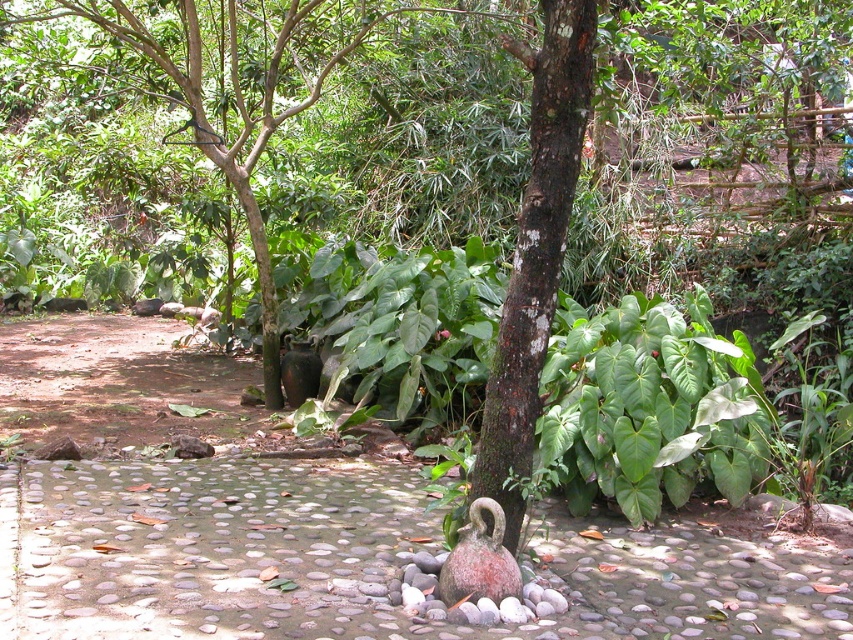
You are a gardener who wants to place a new decorative item on the pebble stone path at center. The item is 30 cm in length. Can the rusty ceramic swan at center currently on the path accommodate this new item without overlapping?

The pebble stone path at center is bigger than the rusty ceramic swan at center. Since the path is larger, there should be enough space to place the new item without overlapping the swan.

You are standing in the garden and want to walk from point A to point B. Point A is at coordinate point A which is point (26, 492) and point B is at coordinate point B which is point (544, 285). Which point is closer to you, point A or point B?

Point A is closer to you because it is further to the camera than point B.

Looking at this image, you are a gardener who wants to plant a new flower bed between the green leafy tree at center and the rusty ceramic swan at center. Since the swan is shorter than the tree, will the swan be visible from the base of the tree?

The green leafy tree at center has a greater height compared to the rusty ceramic swan at center. Therefore, the swan will be visible from the base of the tree because it is shorter, allowing its shape to be seen beneath the tree.